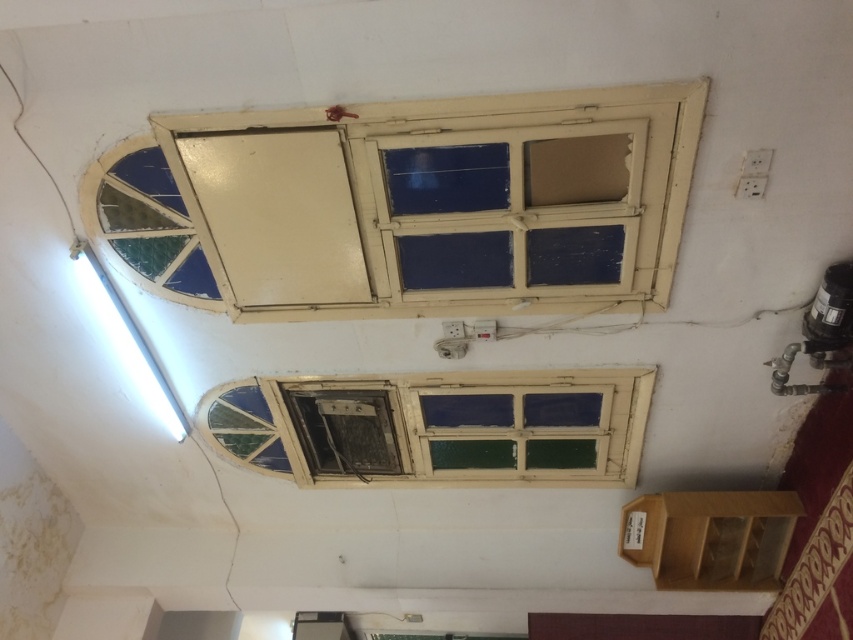
You are standing in front of a wall with two windows. The wall has a fluorescent light fixture to the left of the windows. Where is the matte cream window frame at upper center located in terms of its 2D coordinates?

The matte cream window frame at upper center is located at the 2D coordinates point (x=410, y=205).

You are an interior designer assessing the wall with two windows. The matte cream window frame at upper center and the wooden window frame at center are both candidates for a new paint color. Which window frame should you paint if you want to cover a larger vertical area?

The matte cream window frame at upper center is taller than the wooden window frame at center, so painting the matte cream window frame at upper center would cover a larger vertical area.